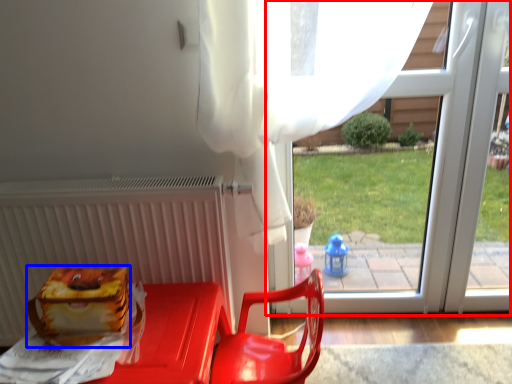
Question: Which of the following is the farthest to the observer, window (highlighted by a red box) or lunch box (highlighted by a blue box)?

Choices:
 (A) window
 (B) lunch box

Answer: (A)